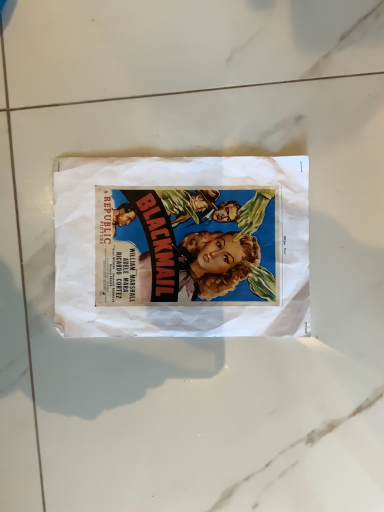
At what (x,y) coordinates should I click in order to perform the action: click on matte paper poster at center. Please return your answer as a coordinate pair (x, y). The width and height of the screenshot is (384, 512). Looking at the image, I should click on (174, 307).

The image size is (384, 512). What do you see at coordinates (174, 307) in the screenshot? I see `matte paper poster at center` at bounding box center [174, 307].

In order to face matte paper poster at center, should I rotate leftwards or rightwards?

Rotate right and turn 1.591 degrees.

This screenshot has width=384, height=512. In order to click on matte paper poster at center in this screenshot , I will do `click(174, 307)`.